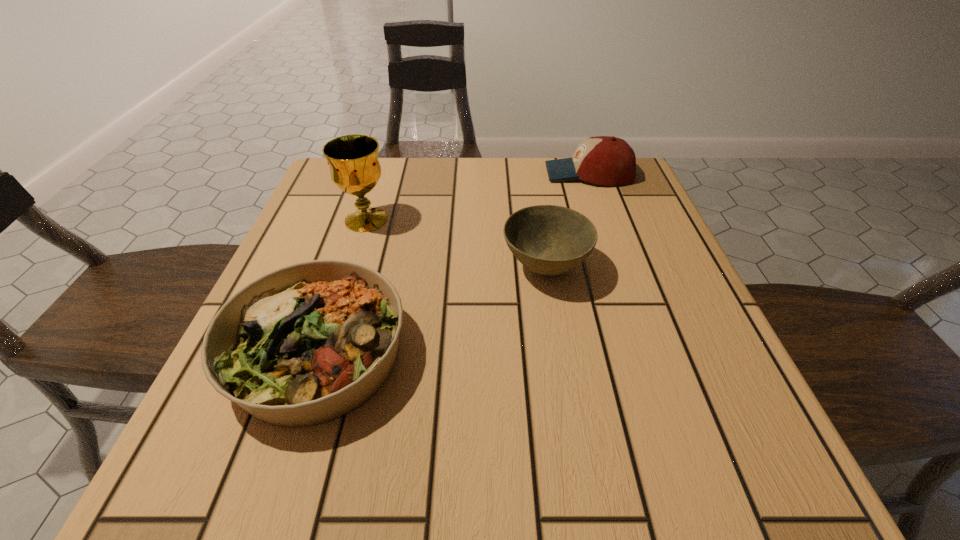
At what (x,y) coordinates should I click in order to perform the action: click on free spot at the far edge of the desktop. Please return your answer as a coordinate pair (x, y). Image resolution: width=960 pixels, height=540 pixels. Looking at the image, I should click on (470, 178).

You are a GUI agent. You are given a task and a screenshot of the screen. Output one action in this format:
    pyautogui.click(x=<x>, y=<y>)
    Task: Click on the vacant position at the near edge of the desktop
    This screenshot has width=960, height=540.
    Given the screenshot: What is the action you would take?
    pyautogui.click(x=511, y=435)

At what (x,y) coordinates should I click in order to perform the action: click on vacant area at the left edge. Please return your answer as a coordinate pair (x, y). This screenshot has width=960, height=540. Looking at the image, I should click on 293,243.

This screenshot has width=960, height=540. I want to click on vacant area at the right edge, so click(x=615, y=296).

At what (x,y) coordinates should I click in order to perform the action: click on vacant space at the far left corner of the desktop. Please return your answer as a coordinate pair (x, y). This screenshot has height=540, width=960. Looking at the image, I should click on (376, 206).

Locate an element on the screen. free space at the near left corner is located at coordinates click(x=214, y=438).

Find the location of `free space at the near right corner of the desktop`. free space at the near right corner of the desktop is located at coordinates (684, 452).

I want to click on free area in between the salad plate and the baseball cap, so click(454, 264).

You are a GUI agent. You are given a task and a screenshot of the screen. Output one action in this format:
    pyautogui.click(x=<x>, y=<y>)
    Task: Click on the vacant space that's between the farthest object and the chalice
    Image resolution: width=960 pixels, height=540 pixels.
    Given the screenshot: What is the action you would take?
    pyautogui.click(x=477, y=197)

I want to click on free space between the salad plate and the bowl, so click(432, 311).